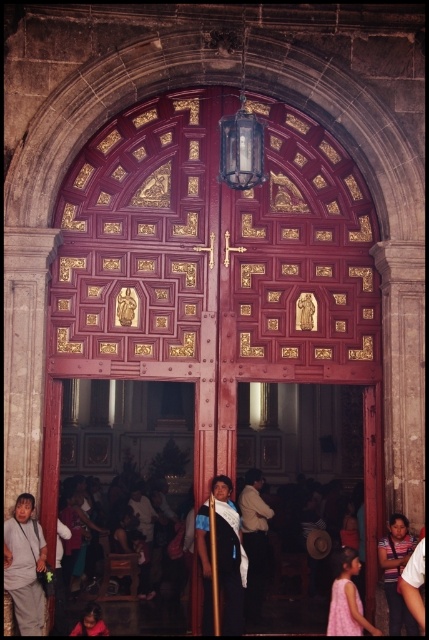
Question: Which point is farther to the camera?

Choices:
 (A) (26, 620)
 (B) (329, 634)
 (C) (257, 548)

Answer: (C)

Question: Can you confirm if blue fabric shawl at center is positioned above striped fabric shirt at lower right?

Choices:
 (A) yes
 (B) no

Answer: (A)

Question: Can you confirm if polished wood door at center is positioned to the left of white cotton shirt at center?

Choices:
 (A) yes
 (B) no

Answer: (A)

Question: Which point is closer to the camera?

Choices:
 (A) blue fabric shawl at center
 (B) polished wood door at center

Answer: (A)

Question: Where is white cotton shirt at center located in relation to striped fabric shirt at lower right in the image?

Choices:
 (A) below
 (B) above

Answer: (A)

Question: Which object appears closest to the camera in this image?

Choices:
 (A) gray fabric jacket at lower left
 (B) polished wood door at center
 (C) blue fabric shawl at center

Answer: (A)